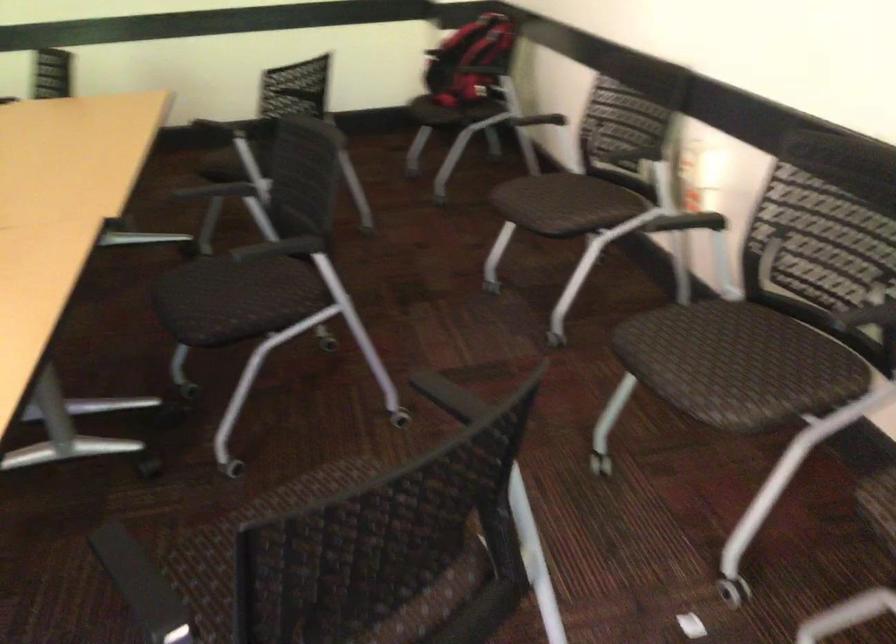
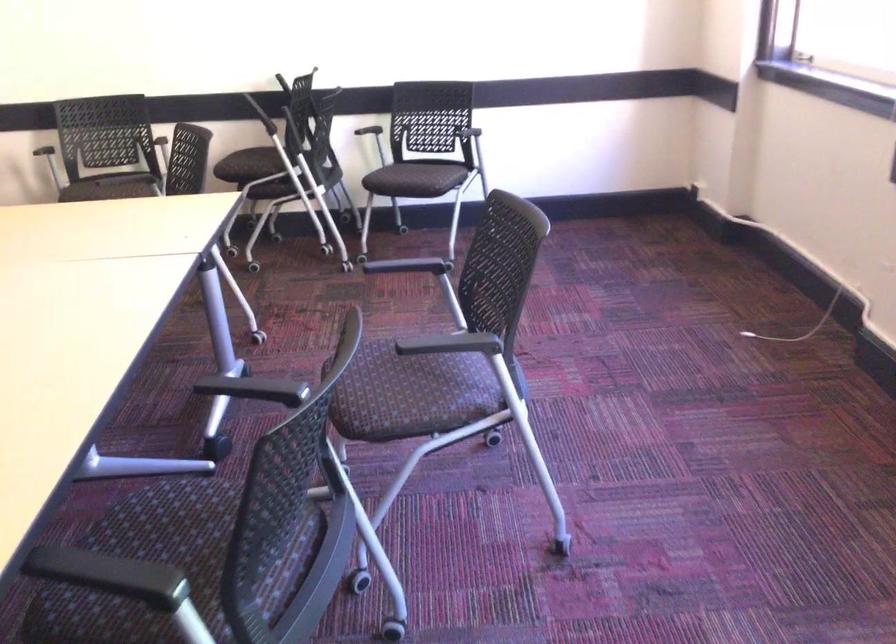
Question: I am providing you with two images of the same scene from different viewpoints. After the viewpoint changes to image2, which objects are now occluded?

Choices:
 (A) wall safe handle
 (B) black chair armrest
 (C) white cable
 (D) chair sitting surface

Answer: (D)